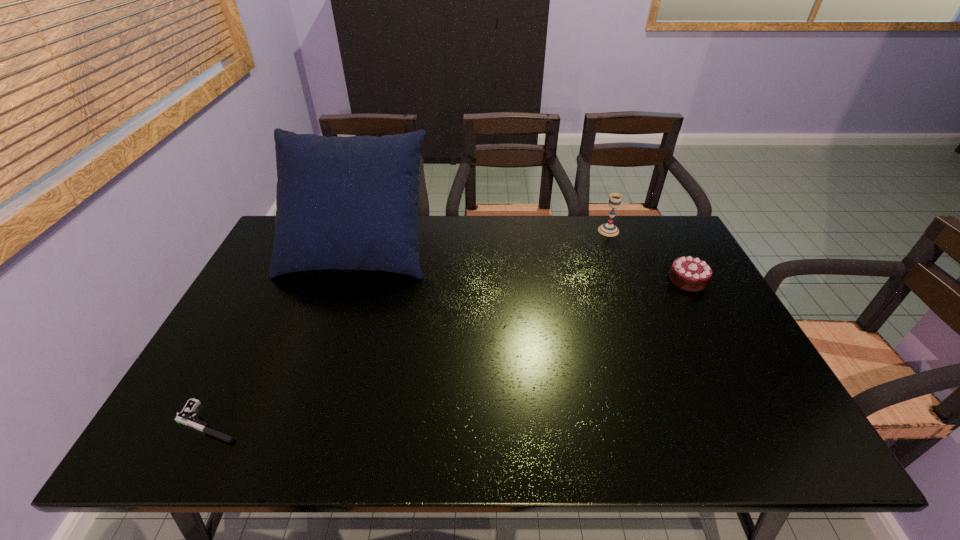
Where is `cushion present at the far edge`? The width and height of the screenshot is (960, 540). cushion present at the far edge is located at coordinates (345, 203).

Where is `chalice at the far edge`? Image resolution: width=960 pixels, height=540 pixels. chalice at the far edge is located at coordinates (608, 229).

Identify the location of object that is at the near edge. Image resolution: width=960 pixels, height=540 pixels. (186, 416).

This screenshot has height=540, width=960. I want to click on cushion that is positioned at the left edge, so click(345, 203).

The width and height of the screenshot is (960, 540). I want to click on pistol located in the left edge section of the desktop, so click(x=186, y=416).

You are a GUI agent. You are given a task and a screenshot of the screen. Output one action in this format:
    pyautogui.click(x=<x>, y=<y>)
    Task: Click on the object located in the right edge section of the desktop
    The height and width of the screenshot is (540, 960).
    Given the screenshot: What is the action you would take?
    pyautogui.click(x=691, y=274)

You are a GUI agent. You are given a task and a screenshot of the screen. Output one action in this format:
    pyautogui.click(x=<x>, y=<y>)
    Task: Click on the object that is at the far left corner
    
    Given the screenshot: What is the action you would take?
    pyautogui.click(x=345, y=203)

Where is `object located at the near left corner`? This screenshot has width=960, height=540. object located at the near left corner is located at coordinates [x=186, y=416].

At what (x,y) coordinates should I click in order to perform the action: click on vacant space at the far edge of the desktop. Please return your answer as a coordinate pair (x, y). This screenshot has height=540, width=960. Looking at the image, I should click on (570, 221).

Identify the location of blank area at the near edge. (460, 424).